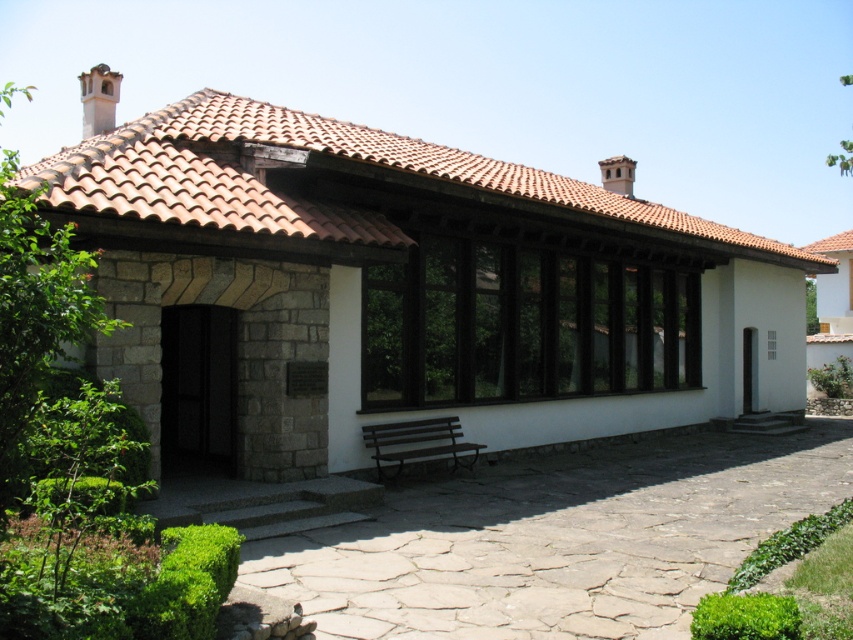
Is brown tile roof at upper center positioned at the back of brown wooden bench at lower center?

That is False.

Which is behind, point (535, 195) or point (461, 444)?

Point (461, 444)

Find the location of a particular element. The image size is (853, 640). brown tile roof at upper center is located at coordinates (329, 154).